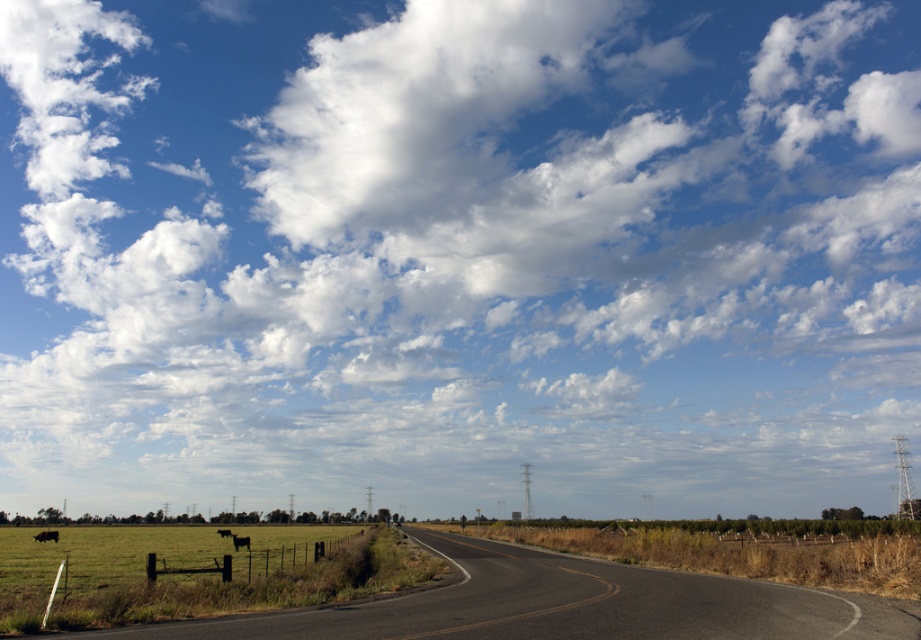
You are a driver who wants to know if the black matte cow at lower left is in the way of the black asphalt highway at lower center. Based on the scene description, can you determine if the cow is on the road or not?

The black asphalt highway at lower center is bigger than the black matte cow at lower left, but the cow is located on the left side of the road enclosed by a wire fence, so it is not on the highway.

You are a photographer standing at the edge of the road. You want to take a photo that includes both the black asphalt highway at lower center and the black glossy cow at left. Which object should be placed closer to the camera to ensure both are in focus?

The black glossy cow at left should be placed closer to the camera because the black asphalt highway at lower center is much taller, so adjusting the cow to be nearer will help maintain focus on both subjects.